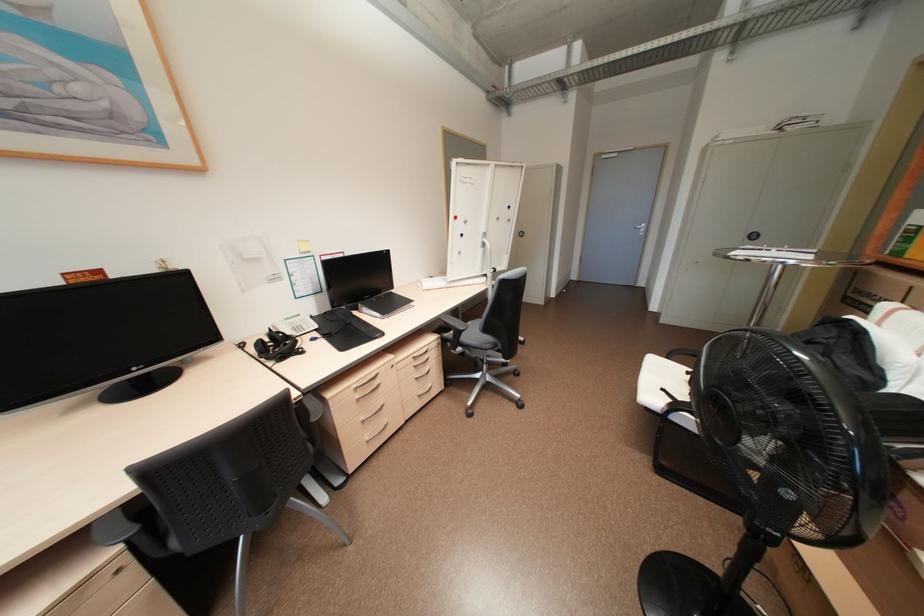
Image resolution: width=924 pixels, height=616 pixels. Find the location of `telephone handset`. telephone handset is located at coordinates (282, 326).